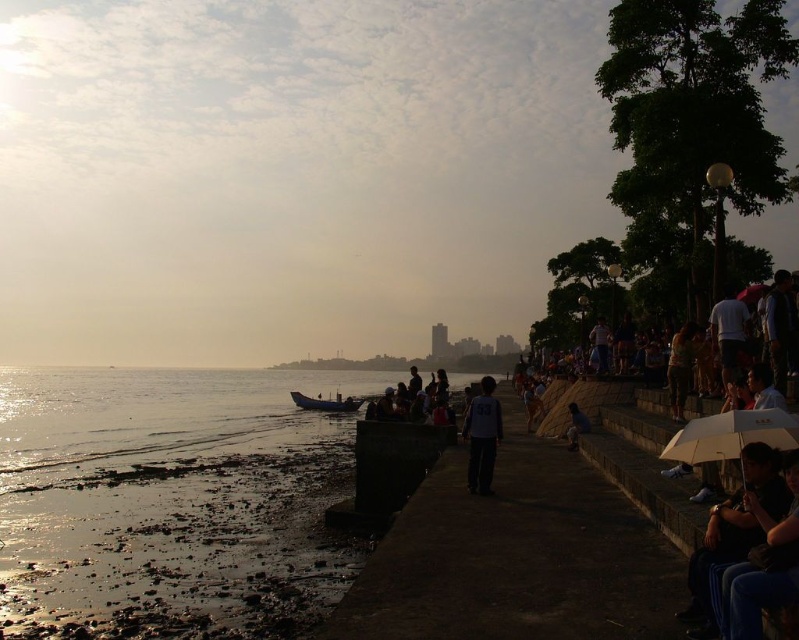
You are standing at the shoreline and see a person wearing a white matte shirt at center and a brown leather jacket at center. Which piece of clothing is nearer to you?

The white matte shirt at center is closer to the viewer than the brown leather jacket at center.

Consider the image. You are standing on the waterfront and see the matte white umbrella at right and the white matte shirt at center. Which object is closer to you?

The matte white umbrella at right is closer to you because it is in front of the white matte shirt at center.